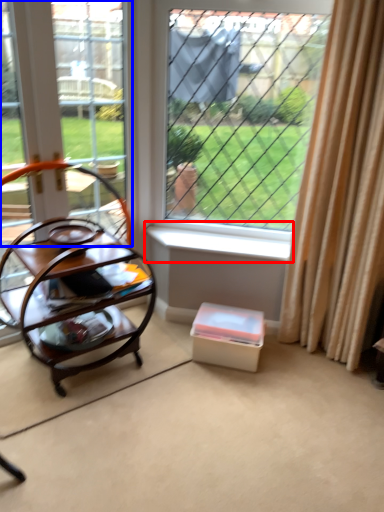
Question: Among these objects, which one is nearest to the camera, window sill (highlighted by a red box) or window frame (highlighted by a blue box)?

Choices:
 (A) window sill
 (B) window frame

Answer: (B)